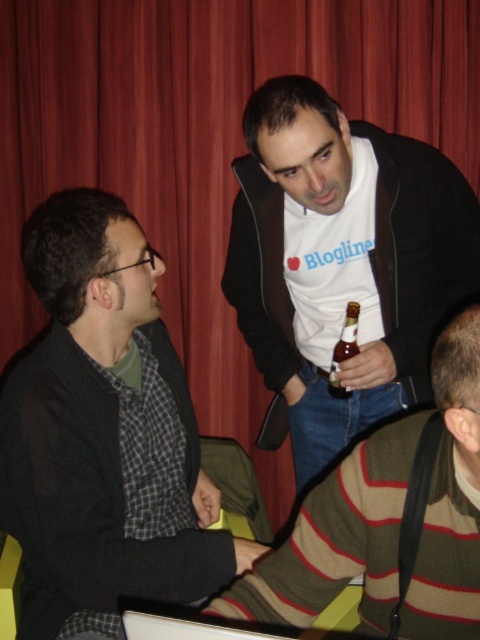
Which is behind, point (305, 124) or point (344, 332)?

Point (344, 332)

Image resolution: width=480 pixels, height=640 pixels. In order to click on white matte shirt at center in this screenshot , I will do `click(342, 262)`.

Does black matte jacket at left appear under white matte shirt at center?

Indeed, black matte jacket at left is positioned under white matte shirt at center.

Based on the photo, measure the distance between black matte jacket at left and white matte shirt at center.

45.43 centimeters

Is point (108, 336) positioned behind point (434, 198)?

No, (108, 336) is closer to viewer.

Locate an element on the screen. This screenshot has height=640, width=480. black matte jacket at left is located at coordinates click(x=103, y=435).

At what (x,y) coordinates should I click in order to perform the action: click on striped wool sweater at lower right. Please return your answer as a coordinate pair (x, y). The width and height of the screenshot is (480, 640). Looking at the image, I should click on (389, 518).

Which is below, striped wool sweater at lower right or brown glass bottle at center?

striped wool sweater at lower right is below.

Between point (379, 531) and point (332, 384), which one is positioned behind?

The point (332, 384) is behind.

This screenshot has width=480, height=640. Identify the location of striped wool sweater at lower right. (389, 518).